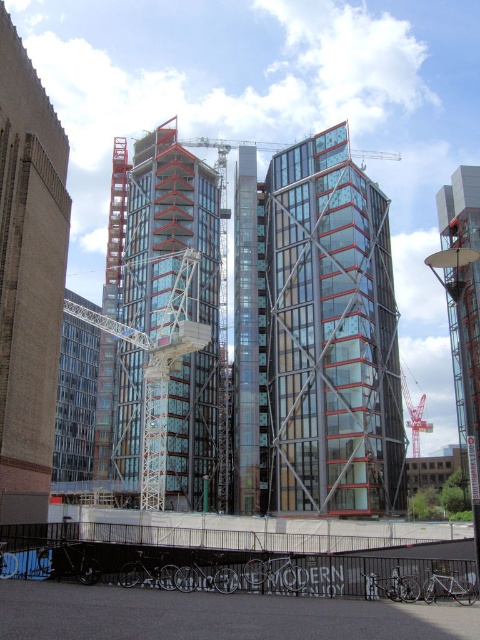
You are a delivery person trying to navigate through the construction site. You need to pass between the brick wall at left and the red metal crane at center. Can you estimate if there is enough space for your delivery van, which is 2.5 meters wide?

The brick wall at left has a smaller size compared to the red metal crane at center, but the exact distance between them isn not provided. Without knowing the gap width, it is impossible to determine if the 2.5 meter wide delivery van can pass safely. Please check the actual space on site.

You are a delivery person trying to navigate through the construction site. You need to deliver a package to the area behind the brick wall at left and the red metal crane at center. Which object do you need to go around first?

The brick wall at left is positioned over the red metal crane at center, so you need to go around the brick wall at left first to reach the area behind both objects.